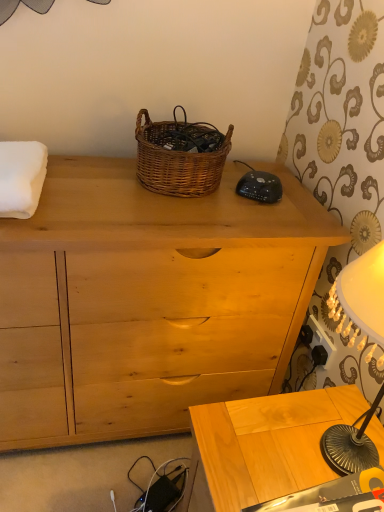
You are a GUI agent. You are given a task and a screenshot of the screen. Output one action in this format:
    pyautogui.click(x=<x>, y=<y>)
    Task: Click on the free space above natural wood chest of drawers at center (from a real-world perspective)
    The width and height of the screenshot is (384, 512).
    Given the screenshot: What is the action you would take?
    pyautogui.click(x=152, y=204)